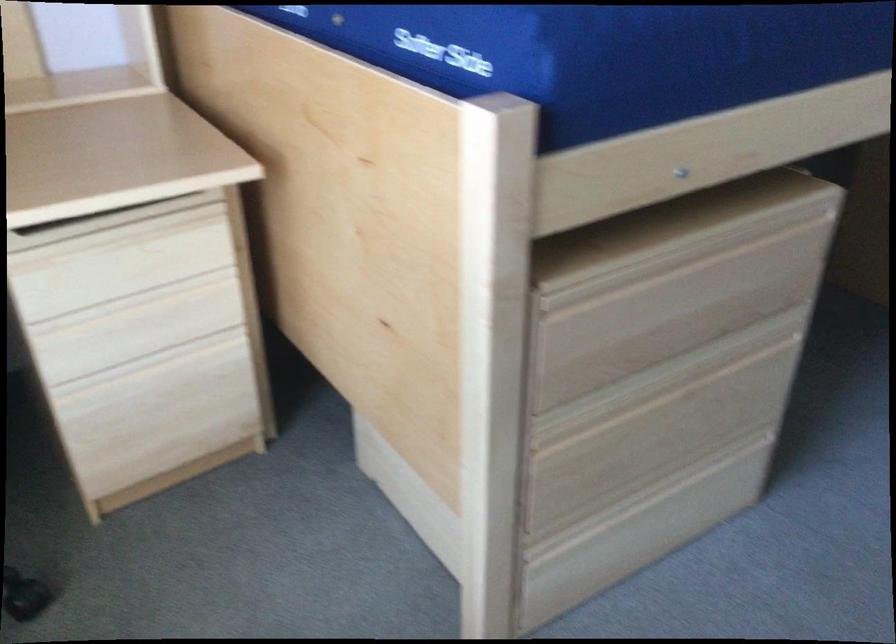
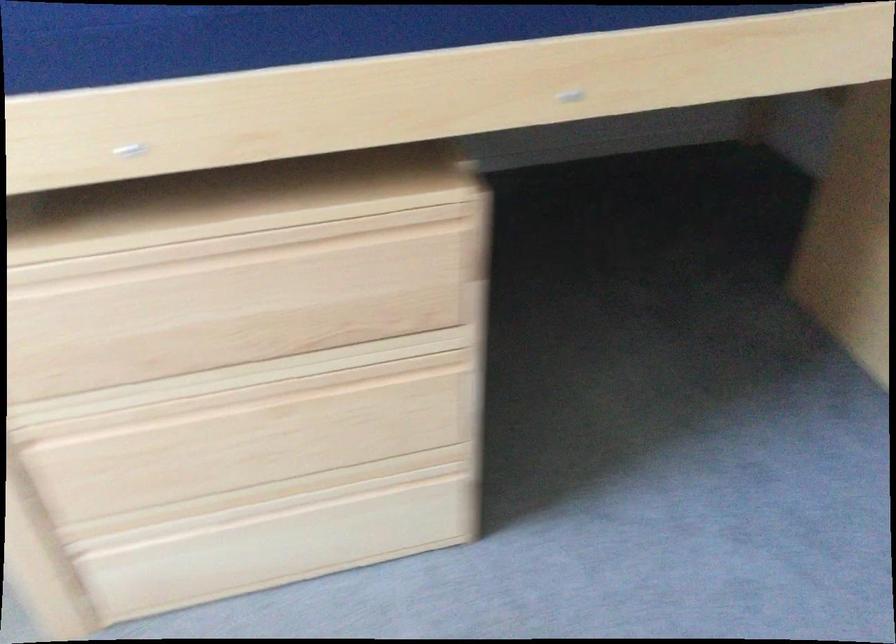
Question: The camera is either moving clockwise (left) or counter-clockwise (right) around the object. The first image is from the beginning of the video and the second image is from the end. Is the camera moving left or right when shooting the video?

Choices:
 (A) Left
 (B) Right

Answer: (B)